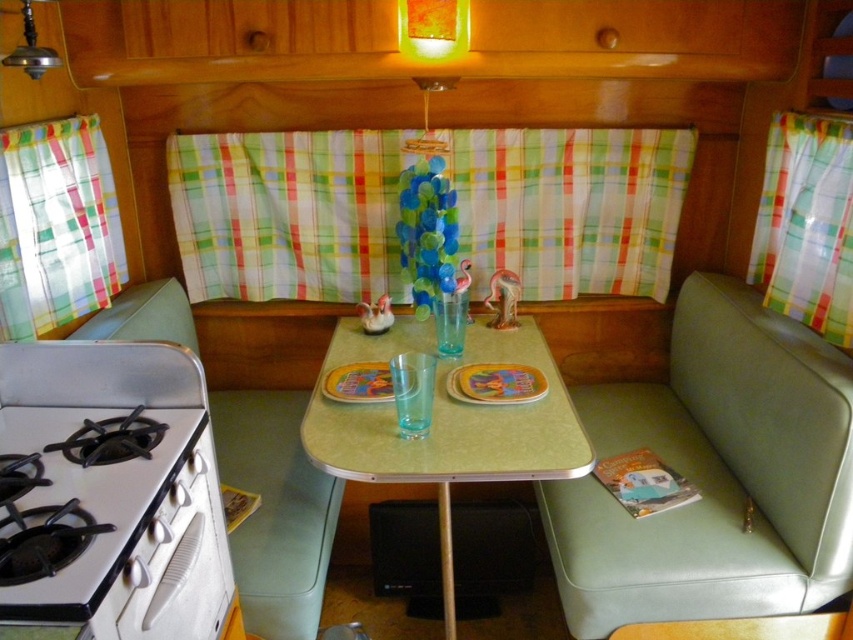
Between green vinyl couch at lower right and white glossy gas stove at lower left, which one appears on the right side from the viewer's perspective?

green vinyl couch at lower right is more to the right.

From the picture: Measure the distance between green vinyl couch at lower right and white glossy gas stove at lower left.

A distance of 3.82 feet exists between green vinyl couch at lower right and white glossy gas stove at lower left.

Is point (825, 384) closer to viewer compared to point (165, 458)?

No, it is behind (165, 458).

What are the coordinates of `green vinyl couch at lower right` in the screenshot? It's located at (714, 474).

Between point (389, 465) and point (67, 609), which one is positioned in front?

Point (67, 609)

Which of these two, green formica table at center or white glossy gas stove at lower left, stands shorter?

With less height is white glossy gas stove at lower left.

Does point (318, 417) lie behind point (9, 433)?

Yes, point (318, 417) is behind point (9, 433).

Where is `green formica table at center`? green formica table at center is located at coordinates (445, 424).

Is white glossy oven at lower left below yellow matte plate at center?

Correct, white glossy oven at lower left is located below yellow matte plate at center.

Is the position of white glossy oven at lower left less distant than that of yellow matte plate at center?

Yes.

Between point (161, 504) and point (521, 384), which one is positioned in front?

Point (161, 504) is in front.

You are a GUI agent. You are given a task and a screenshot of the screen. Output one action in this format:
    pyautogui.click(x=<x>, y=<y>)
    Task: Click on the white glossy oven at lower left
    The image size is (853, 640).
    Given the screenshot: What is the action you would take?
    pyautogui.click(x=175, y=566)